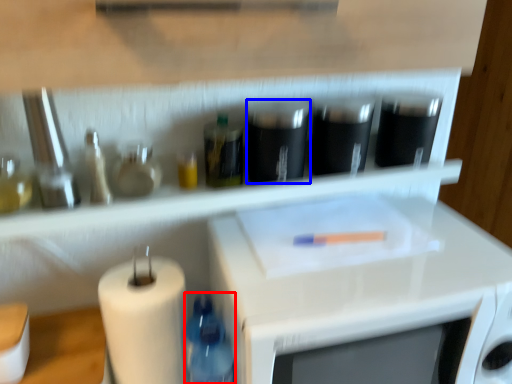
Question: Which of the following is the closest to the observer, bottle (highlighted by a red box) or appliance (highlighted by a blue box)?

Choices:
 (A) bottle
 (B) appliance

Answer: (A)